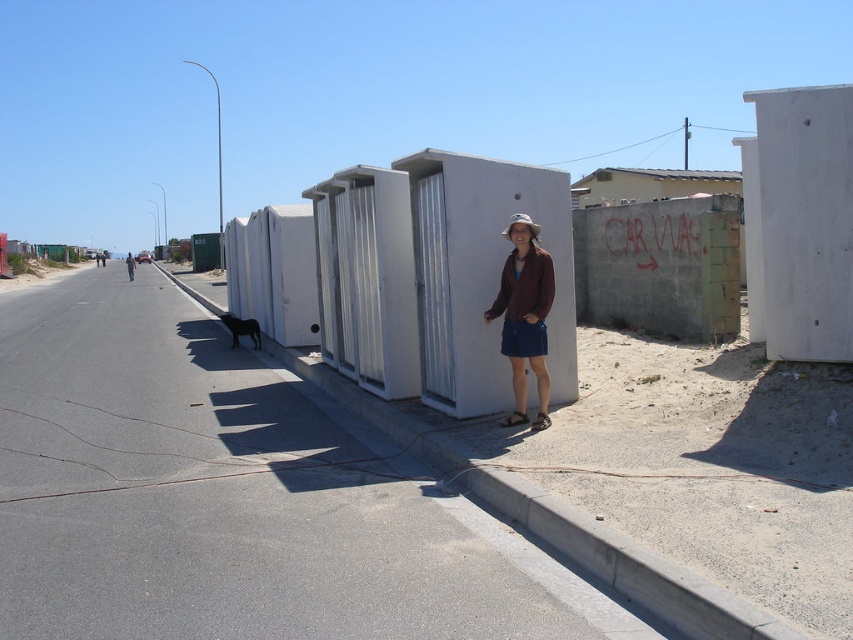
Does white concrete hut at center have a lesser width compared to metallic corrugated roof at upper center?

Yes.

How much distance is there between white concrete hut at center and metallic corrugated roof at upper center?

white concrete hut at center is 24.03 meters away from metallic corrugated roof at upper center.

Does point (305, 292) lie behind point (637, 188)?

No, (305, 292) is closer to viewer.

In order to click on white concrete hut at center in this screenshot , I will do `click(273, 272)`.

Is white concrete wall at upper right further to the viewer compared to metallic corrugated roof at upper center?

No, it is in front of metallic corrugated roof at upper center.

Does point (780, 284) come behind point (602, 196)?

No, (780, 284) is closer to viewer.

Where is `white concrete wall at upper right`? The height and width of the screenshot is (640, 853). white concrete wall at upper right is located at coordinates (799, 221).

Is white concrete wall at upper right in front of brown leather jacket at center?

Yes, white concrete wall at upper right is closer to the viewer.

Can you confirm if white concrete wall at upper right is positioned below brown leather jacket at center?

No.

Who is more distant from viewer, (756, 237) or (132, 273)?

The point (132, 273) is behind.

The image size is (853, 640). Identify the location of white concrete wall at upper right. (799, 221).